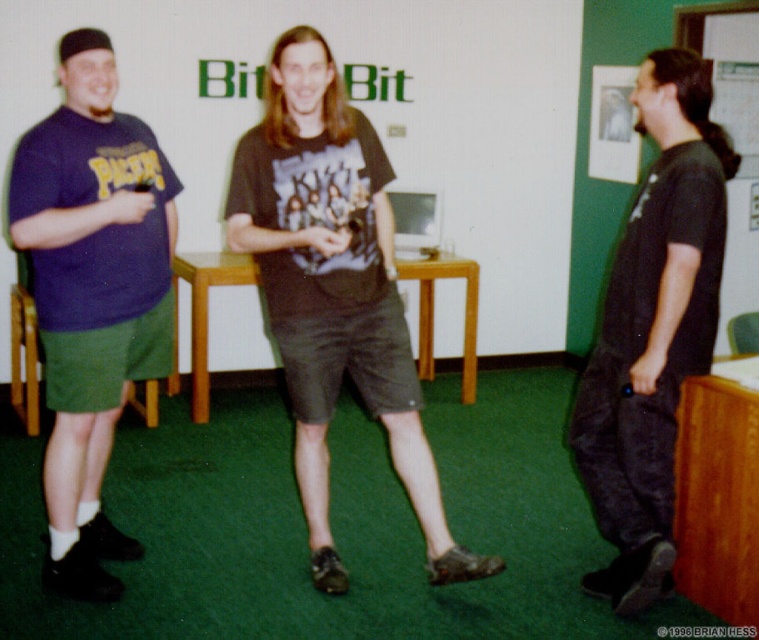
Who is lower down, black matte t-shirt at center or black matte pants at right?

black matte pants at right is lower down.

Does black matte t-shirt at center have a lesser width compared to black matte pants at right?

No.

Image resolution: width=759 pixels, height=640 pixels. What do you see at coordinates (332, 289) in the screenshot?
I see `black matte t-shirt at center` at bounding box center [332, 289].

Where is `black matte t-shirt at center`? This screenshot has height=640, width=759. black matte t-shirt at center is located at coordinates (332, 289).

Which is behind, point (310, 227) or point (30, 161)?

Positioned behind is point (310, 227).

Can you confirm if black matte t-shirt at center is positioned to the right of purple matte t-shirt at left?

Correct, you'll find black matte t-shirt at center to the right of purple matte t-shirt at left.

Locate an element on the screen. black matte t-shirt at center is located at coordinates (332, 289).

Is purple matte t-shirt at left above black matte pants at right?

Yes, purple matte t-shirt at left is above black matte pants at right.

Describe the element at coordinates (93, 294) in the screenshot. I see `purple matte t-shirt at left` at that location.

Is point (77, 288) less distant than point (646, 396)?

That is False.

You are a GUI agent. You are given a task and a screenshot of the screen. Output one action in this format:
    pyautogui.click(x=<x>, y=<y>)
    Task: Click on the purple matte t-shirt at left
    
    Given the screenshot: What is the action you would take?
    pyautogui.click(x=93, y=294)